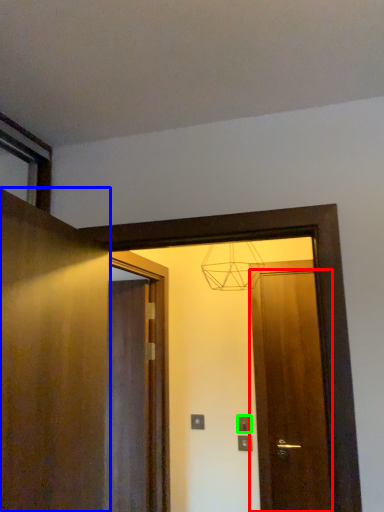
Question: Which is nearer to the door (highlighted by a red box)? door (highlighted by a blue box) or electric outlet (highlighted by a green box).

Choices:
 (A) door
 (B) electric outlet

Answer: (B)